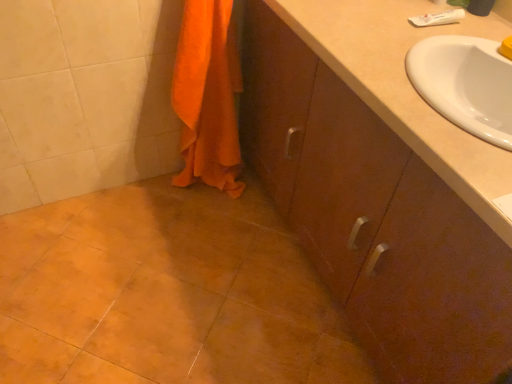
Locate an element on the screen. vacant space to the left of orange cotton towel at lower left is located at coordinates (145, 195).